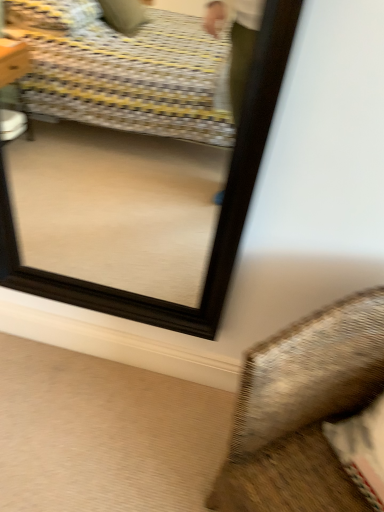
What do you see at coordinates (219, 218) in the screenshot?
I see `black wooden mirror at upper center` at bounding box center [219, 218].

I want to click on black wooden mirror at upper center, so click(x=219, y=218).

Describe the element at coordinates (302, 411) in the screenshot. I see `textured fabric pillow at lower right` at that location.

The height and width of the screenshot is (512, 384). What are the coordinates of `textured fabric pillow at lower right` in the screenshot? It's located at (302, 411).

Locate an element on the screen. black wooden mirror at upper center is located at coordinates (219, 218).

Is black wooden mirror at upper center at the right side of textured fabric pillow at lower right?

In fact, black wooden mirror at upper center is to the left of textured fabric pillow at lower right.

Is black wooden mirror at upper center positioned before textured fabric pillow at lower right?

No, black wooden mirror at upper center is further to the viewer.

Is point (209, 329) positioned after point (280, 464)?

That is True.

From the image's perspective, is black wooden mirror at upper center beneath textured fabric pillow at lower right?

Incorrect, from the image's perspective, black wooden mirror at upper center is higher than textured fabric pillow at lower right.

From a real-world perspective, who is located lower, black wooden mirror at upper center or textured fabric pillow at lower right?

In real-world perspective, textured fabric pillow at lower right is lower.

Can you confirm if black wooden mirror at upper center is wider than textured fabric pillow at lower right?

In fact, black wooden mirror at upper center might be narrower than textured fabric pillow at lower right.

Does black wooden mirror at upper center have a greater height compared to textured fabric pillow at lower right?

Indeed, black wooden mirror at upper center has a greater height compared to textured fabric pillow at lower right.

Which of these two, black wooden mirror at upper center or textured fabric pillow at lower right, is bigger?

With larger size is textured fabric pillow at lower right.

Is black wooden mirror at upper center located outside textured fabric pillow at lower right?

Yes.

Is black wooden mirror at upper center next to textured fabric pillow at lower right and touching it?

No, black wooden mirror at upper center is not making contact with textured fabric pillow at lower right.

Is black wooden mirror at upper center facing away from textured fabric pillow at lower right?

No, black wooden mirror at upper center's orientation is not away from textured fabric pillow at lower right.

Based on the photo, measure the distance between black wooden mirror at upper center and textured fabric pillow at lower right.

black wooden mirror at upper center and textured fabric pillow at lower right are 17.57 inches apart from each other.

The width and height of the screenshot is (384, 512). In order to click on furniture in front of the black wooden mirror at upper center in this screenshot , I will do `click(302, 411)`.

Does textured fabric pillow at lower right appear on the right side of black wooden mirror at upper center?

Yes.

Based on the photo, is textured fabric pillow at lower right in front of or behind black wooden mirror at upper center in the image?

textured fabric pillow at lower right is in front of black wooden mirror at upper center.

Is point (256, 422) positioned after point (246, 167)?

That is False.

From the image's perspective, between textured fabric pillow at lower right and black wooden mirror at upper center, who is located below?

textured fabric pillow at lower right, from the image's perspective.

From a real-world perspective, is textured fabric pillow at lower right above or below black wooden mirror at upper center?

textured fabric pillow at lower right is situated lower than black wooden mirror at upper center in the real world.

Is textured fabric pillow at lower right wider than black wooden mirror at upper center?

Yes.

From the picture: Between textured fabric pillow at lower right and black wooden mirror at upper center, which one has more height?

Standing taller between the two is black wooden mirror at upper center.

Consider the image. Can you confirm if textured fabric pillow at lower right is bigger than black wooden mirror at upper center?

Indeed, textured fabric pillow at lower right has a larger size compared to black wooden mirror at upper center.

Is black wooden mirror at upper center inside textured fabric pillow at lower right?

Definitely not — black wooden mirror at upper center is not inside textured fabric pillow at lower right.

Based on the photo, are textured fabric pillow at lower right and black wooden mirror at upper center beside each other?

textured fabric pillow at lower right and black wooden mirror at upper center are clearly separated.

Is textured fabric pillow at lower right oriented away from black wooden mirror at upper center?

No, black wooden mirror at upper center is not at the back of textured fabric pillow at lower right.

What's the angular difference between textured fabric pillow at lower right and black wooden mirror at upper center's facing directions?

textured fabric pillow at lower right and black wooden mirror at upper center are facing 47.3 degrees away from each other.

This screenshot has height=512, width=384. I want to click on furniture below the black wooden mirror at upper center (from the image's perspective), so click(x=302, y=411).

The image size is (384, 512). I want to click on furniture that is under the black wooden mirror at upper center (from a real-world perspective), so click(302, 411).

This screenshot has width=384, height=512. Find the location of `furniture below the black wooden mirror at upper center (from the image's perspective)`. furniture below the black wooden mirror at upper center (from the image's perspective) is located at coordinates (302, 411).